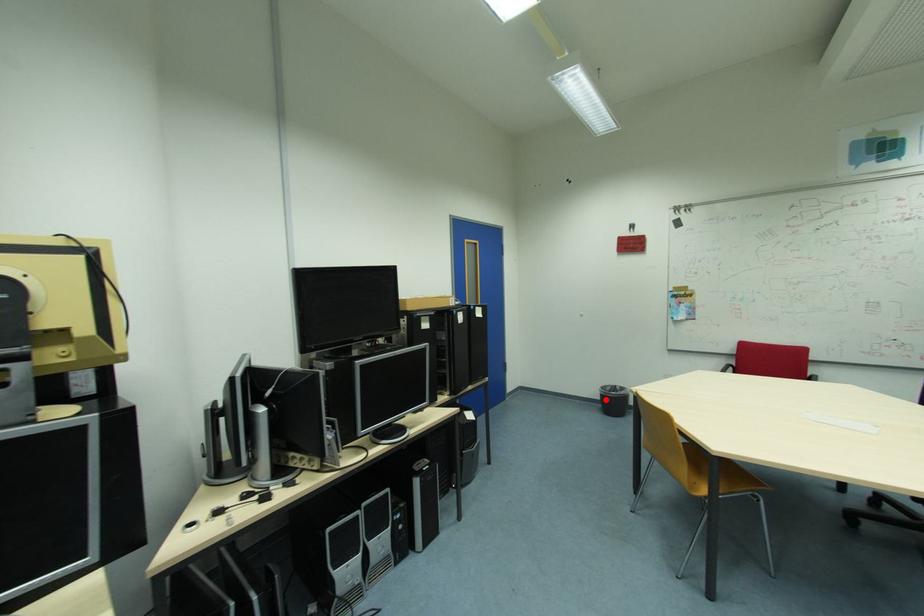
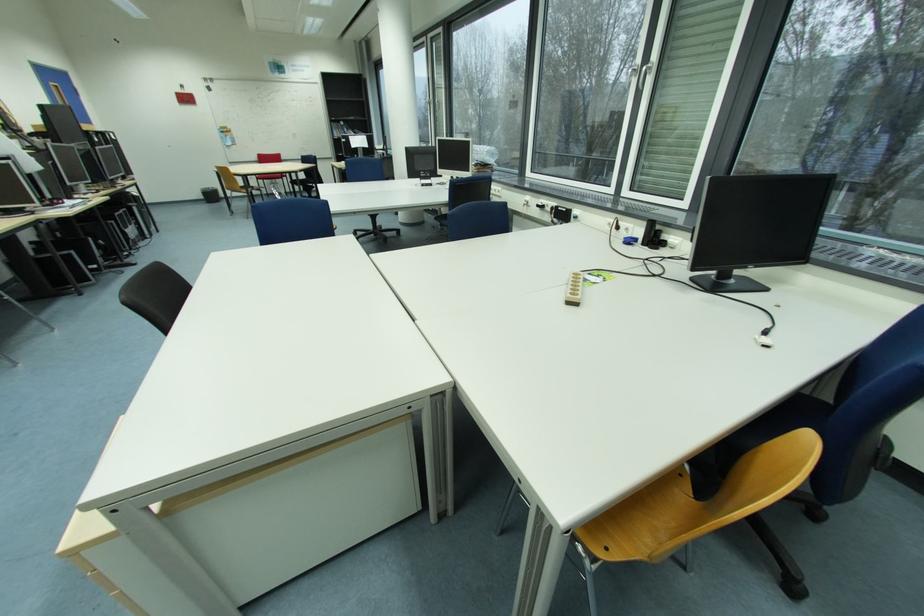
Find the pixel in the second image that matches the highlighted location in the first image.

(209, 198)